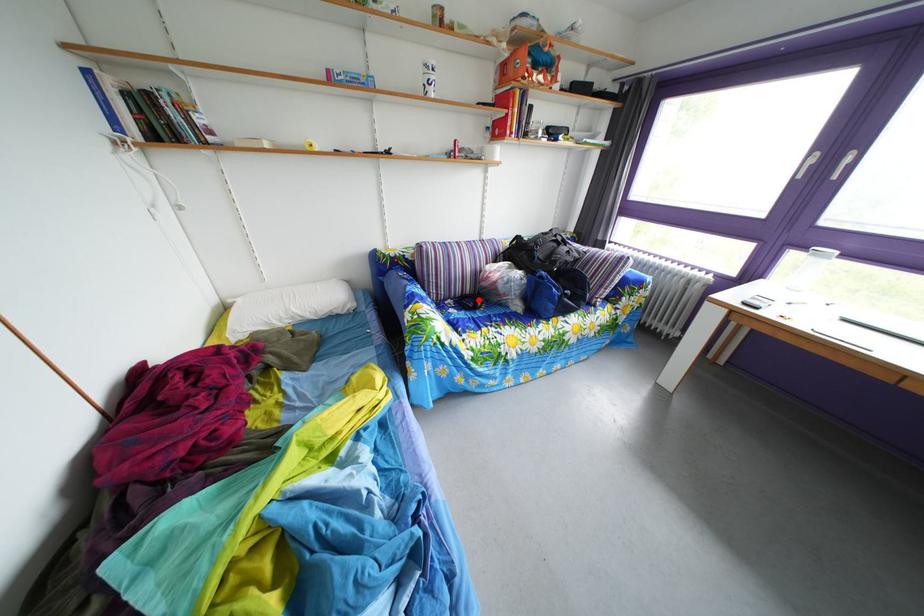
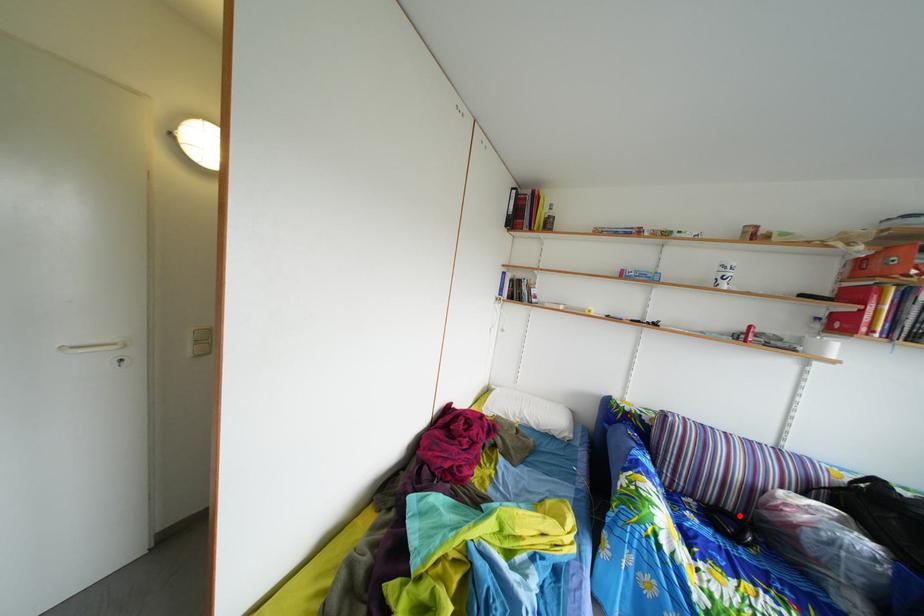
I am providing you with two images of the same scene from different viewpoints. A red point is marked on the first image and another point is marked on the second image. Is the marked point in image1 the same physical position as the marked point in image2?

Yes